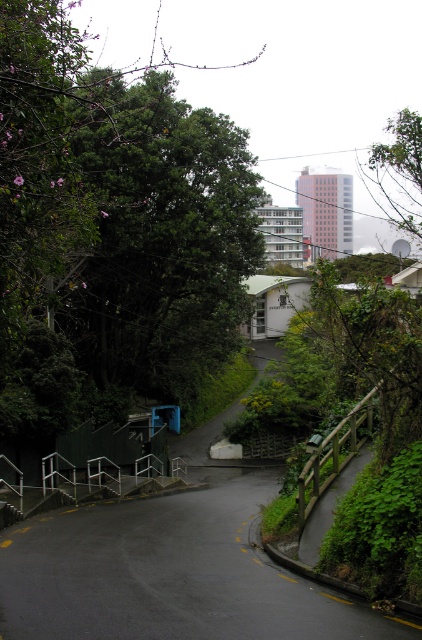
Question: Where is black asphalt road at center located in relation to green leafy tree at upper right in the image?

Choices:
 (A) left
 (B) right

Answer: (A)

Question: Which of the following is the closest to the observer?

Choices:
 (A) (132, 616)
 (B) (408, 209)
 (C) (121, 298)

Answer: (A)

Question: Which point appears farthest from the camera in this image?

Choices:
 (A) (373, 182)
 (B) (245, 518)

Answer: (A)

Question: Is green leafy tree at upper left thinner than black asphalt road at center?

Choices:
 (A) yes
 (B) no

Answer: (B)

Question: In this image, where is black asphalt road at center located relative to green leafy tree at upper right?

Choices:
 (A) below
 (B) above

Answer: (A)

Question: Among these objects, which one is farthest from the camera?

Choices:
 (A) black asphalt road at center
 (B) green leafy tree at upper right
 (C) green leafy tree at upper left

Answer: (B)